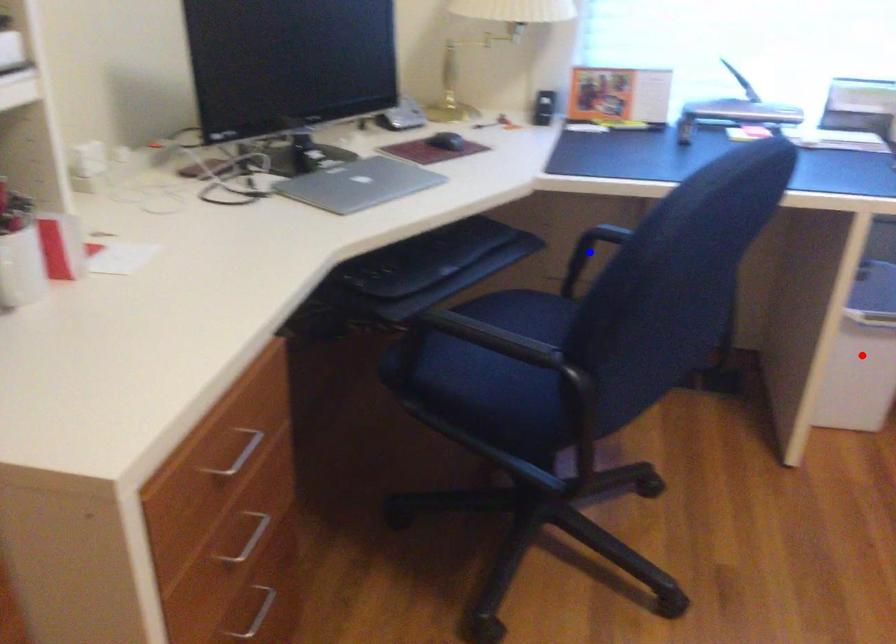
Question: In the image, two points are highlighted. Which point is nearer to the camera? Reply with the corresponding letter.

Choices:
 (A) blue point
 (B) red point

Answer: (A)